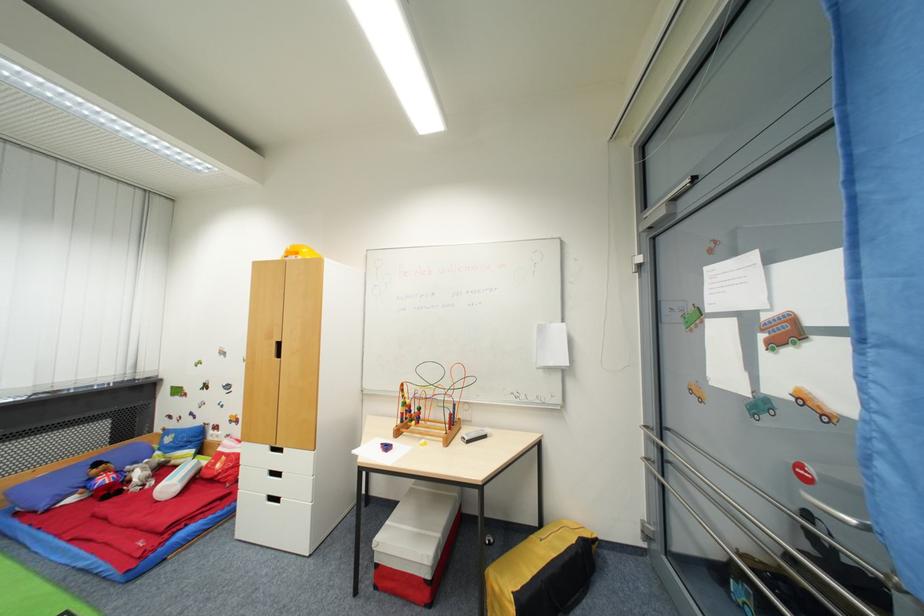
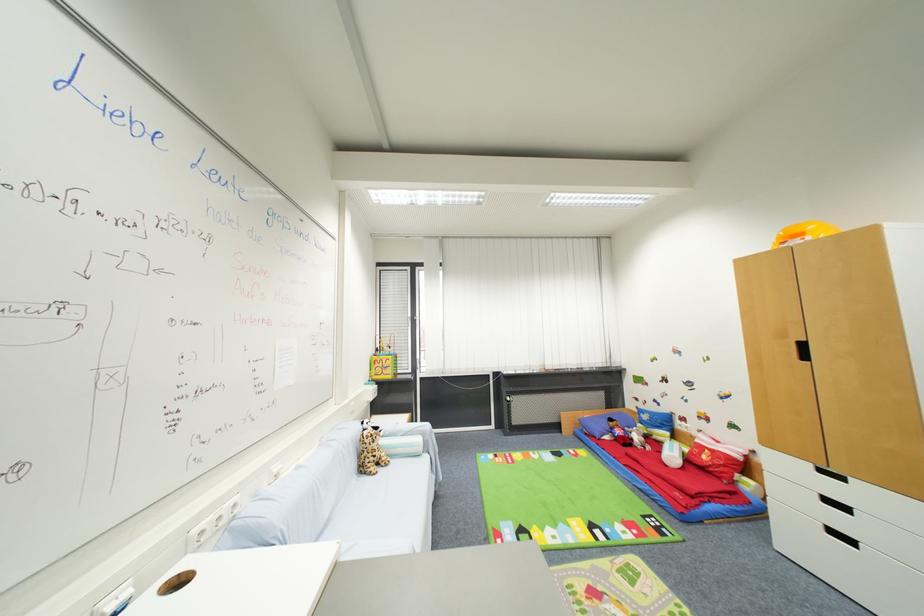
Question: The camera is either moving clockwise (left) or counter-clockwise (right) around the object. The first image is from the beginning of the video and the second image is from the end. Is the camera moving left or right when shooting the video?

Choices:
 (A) Left
 (B) Right

Answer: (B)